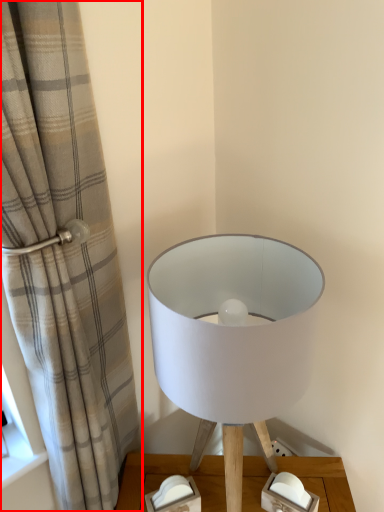
Question: Considering the relative positions of curtain (annotated by the red box) and lamp in the image provided, where is curtain (annotated by the red box) located with respect to the staircase?

Choices:
 (A) right
 (B) left

Answer: (B)